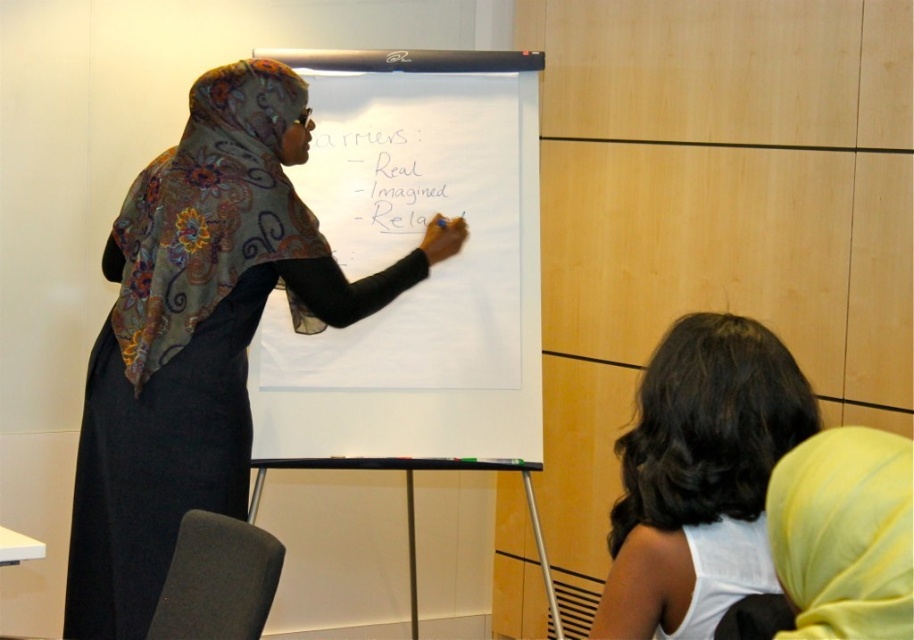
Question: Does matte floral hijab at center appear on the left side of dark brown hair at lower right?

Choices:
 (A) no
 (B) yes

Answer: (B)

Question: Which point is farther to the camera?

Choices:
 (A) dark brown hair at lower right
 (B) whiteboard at center

Answer: (B)

Question: Can you confirm if whiteboard at center is positioned above dark brown hair at lower right?

Choices:
 (A) no
 (B) yes

Answer: (B)

Question: Which object is closer to the camera taking this photo?

Choices:
 (A) dark brown hair at lower right
 (B) matte floral hijab at center
 (C) whiteboard at center

Answer: (A)

Question: Is whiteboard at center further to camera compared to matte floral hijab at center?

Choices:
 (A) yes
 (B) no

Answer: (A)

Question: Which point is farther to the camera?

Choices:
 (A) pyautogui.click(x=119, y=244)
 (B) pyautogui.click(x=620, y=636)
 (C) pyautogui.click(x=460, y=372)

Answer: (C)